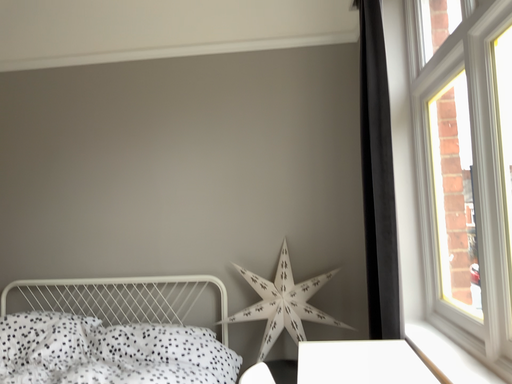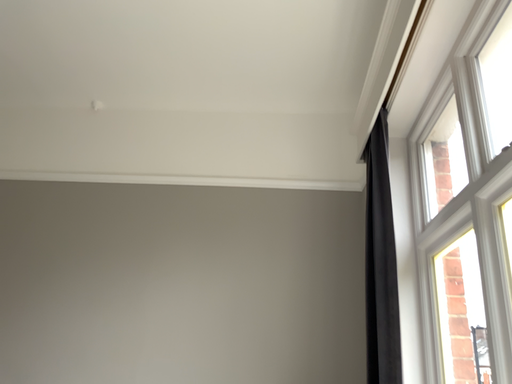
Question: Which way did the camera rotate in the video?

Choices:
 (A) rotated downward
 (B) rotated upward

Answer: (B)